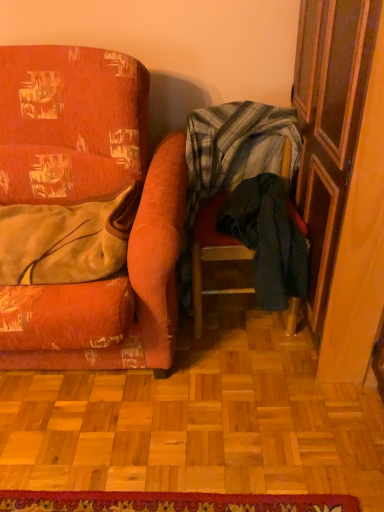
Find the location of a particular element. The height and width of the screenshot is (512, 384). vacant space behind red woven mat at lower center is located at coordinates (188, 426).